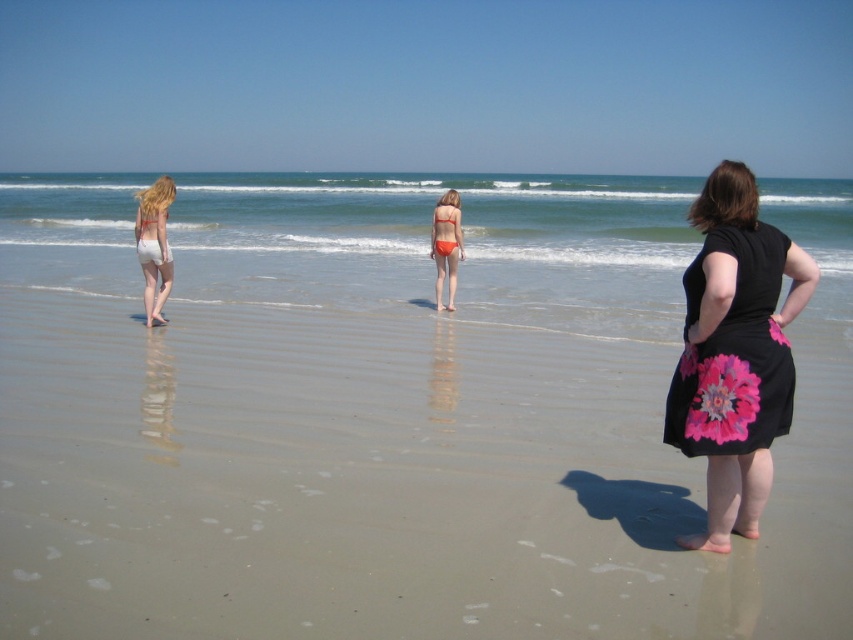
Question: In this image, where is blue water at center located relative to white cotton shorts at left?

Choices:
 (A) left
 (B) right

Answer: (A)

Question: Does black floral dress at right appear on the left side of white cotton shorts at left?

Choices:
 (A) yes
 (B) no

Answer: (B)

Question: Which object is the closest to the blue water at center?

Choices:
 (A) sandy beach at center
 (B) orange matte bikini at center

Answer: (A)

Question: Can you confirm if sandy beach at center is thinner than white cotton shorts at left?

Choices:
 (A) no
 (B) yes

Answer: (A)

Question: Which point is closer to the camera taking this photo?

Choices:
 (A) (740, 355)
 (B) (540, 564)
 (C) (666, 259)

Answer: (A)

Question: Which point appears farthest from the camera in this image?

Choices:
 (A) (167, 289)
 (B) (480, 196)
 (C) (415, 612)

Answer: (B)